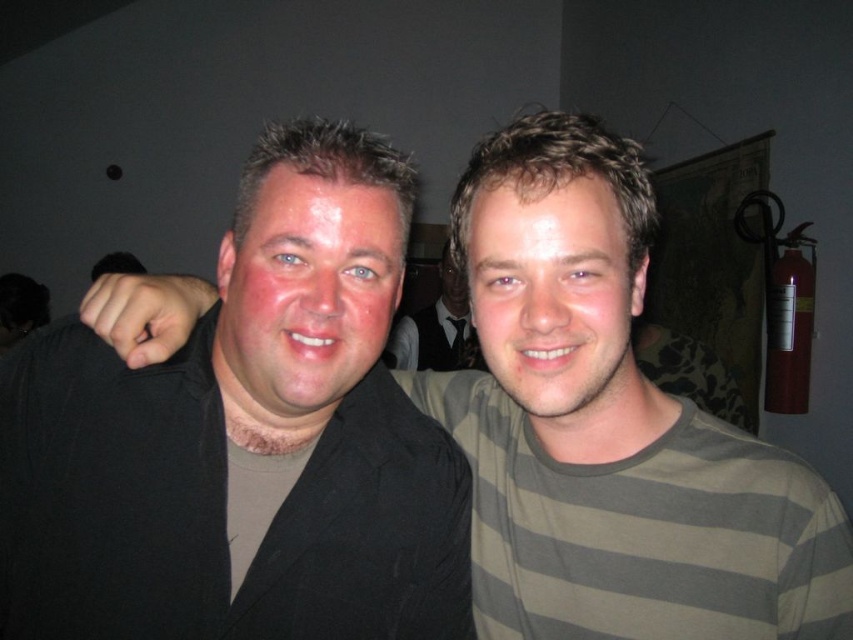
Question: Which is nearer to the matte black face at center?

Choices:
 (A) black matte jacket at left
 (B) matte black shirt at center

Answer: (A)

Question: Among these points, which one is nearest to the camera?

Choices:
 (A) (329, 246)
 (B) (427, 316)
 (C) (572, 412)

Answer: (A)

Question: Does black matte jacket at left lie behind matte black shirt at center?

Choices:
 (A) no
 (B) yes

Answer: (A)

Question: Considering the real-world distances, which object is closest to the matte black face at center?

Choices:
 (A) matte black shirt at center
 (B) brown striped shirt at center
 (C) black matte jacket at left

Answer: (C)

Question: From the image, what is the correct spatial relationship of black matte jacket at left in relation to matte black face at center?

Choices:
 (A) left
 (B) right

Answer: (A)

Question: From the image, what is the correct spatial relationship of black matte jacket at left in relation to matte black shirt at center?

Choices:
 (A) below
 (B) above

Answer: (A)